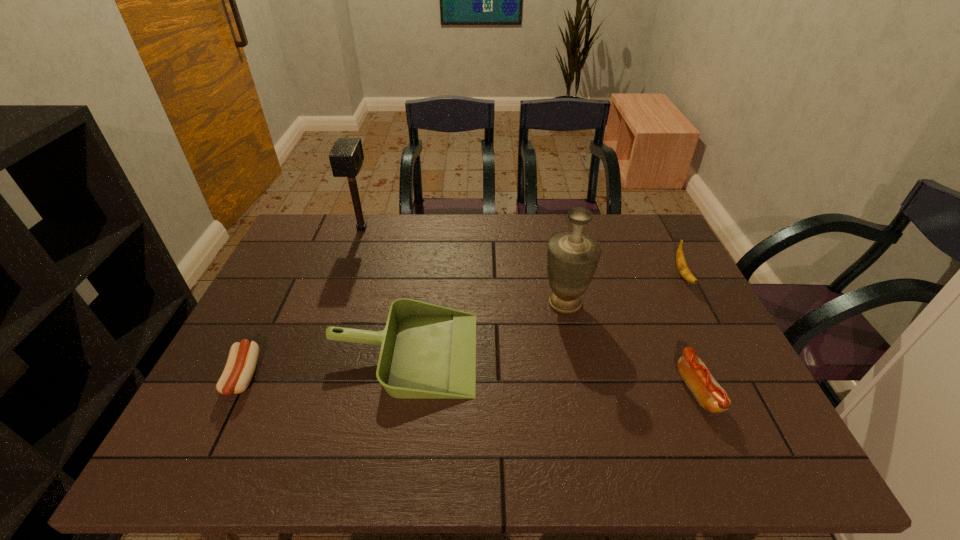
Where is `vacant space located on the scoop of the dustpan`? This screenshot has width=960, height=540. vacant space located on the scoop of the dustpan is located at coordinates (591, 353).

Locate an element on the screen. The image size is (960, 540). vacant space located 0.140m on the peel of the banana from the top is located at coordinates (711, 329).

Where is `free region located on the back of the fifth tallest object`? The width and height of the screenshot is (960, 540). free region located on the back of the fifth tallest object is located at coordinates (660, 303).

At what (x,y) coordinates should I click in order to perform the action: click on free space located on the right of the shortest object. Please return your answer as a coordinate pair (x, y). This screenshot has height=540, width=960. Looking at the image, I should click on (364, 377).

Where is `object at the far edge`? object at the far edge is located at coordinates (346, 157).

Locate an element on the screen. The image size is (960, 540). object present at the left edge is located at coordinates (242, 360).

You are a GUI agent. You are given a task and a screenshot of the screen. Output one action in this format:
    pyautogui.click(x=<x>, y=<y>)
    Task: Click on the banana that is positioned at the right edge
    The height and width of the screenshot is (540, 960).
    Given the screenshot: What is the action you would take?
    (x=682, y=266)

At what (x,y) coordinates should I click in order to perform the action: click on sausage located at the right edge. Please return your answer as a coordinate pair (x, y). Image resolution: width=960 pixels, height=540 pixels. Looking at the image, I should click on (709, 394).

I want to click on vacant space at the far edge of the desktop, so click(x=452, y=226).

The width and height of the screenshot is (960, 540). I want to click on vacant space at the near edge, so click(x=482, y=466).